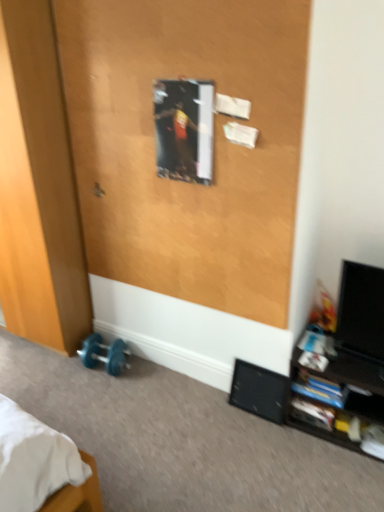
Question: Considering the relative sizes of wooden poster at upper center, which is counted as the 1th screen door, starting from the right, and black matte speaker at lower right in the image provided, is wooden poster at upper center, which is counted as the 1th screen door, starting from the right, bigger than black matte speaker at lower right?

Choices:
 (A) no
 (B) yes

Answer: (B)

Question: Can you confirm if wooden poster at upper center, which is counted as the 1th screen door, starting from the right, is smaller than black matte speaker at lower right?

Choices:
 (A) no
 (B) yes

Answer: (A)

Question: Considering the relative positions of wooden poster at upper center, arranged as the second screen door when viewed from the left, and black matte speaker at lower right in the image provided, is wooden poster at upper center, arranged as the second screen door when viewed from the left, behind black matte speaker at lower right?

Choices:
 (A) yes
 (B) no

Answer: (B)

Question: Can you confirm if wooden poster at upper center, which is counted as the 1th screen door, starting from the right, is wider than black matte speaker at lower right?

Choices:
 (A) no
 (B) yes

Answer: (A)

Question: Considering the relative sizes of wooden poster at upper center, which is counted as the 1th screen door, starting from the right, and black matte speaker at lower right in the image provided, is wooden poster at upper center, which is counted as the 1th screen door, starting from the right, thinner than black matte speaker at lower right?

Choices:
 (A) yes
 (B) no

Answer: (A)

Question: From a real-world perspective, is wooden poster at upper center, which is counted as the 1th screen door, starting from the right, under black matte speaker at lower right?

Choices:
 (A) no
 (B) yes

Answer: (A)

Question: From a real-world perspective, is wooden poster at upper center, which is counted as the 1th screen door, starting from the right, beneath metallic silver door handle at upper center?

Choices:
 (A) no
 (B) yes

Answer: (A)

Question: Is wooden poster at upper center, arranged as the second screen door when viewed from the left, further to camera compared to metallic silver door handle at upper center?

Choices:
 (A) no
 (B) yes

Answer: (A)

Question: From a real-world perspective, is wooden poster at upper center, arranged as the second screen door when viewed from the left, on top of metallic silver door handle at upper center?

Choices:
 (A) no
 (B) yes

Answer: (B)

Question: Considering the relative sizes of wooden poster at upper center, which is counted as the 1th screen door, starting from the right, and metallic silver door handle at upper center in the image provided, is wooden poster at upper center, which is counted as the 1th screen door, starting from the right, bigger than metallic silver door handle at upper center?

Choices:
 (A) yes
 (B) no

Answer: (A)

Question: From the image's perspective, would you say wooden poster at upper center, arranged as the second screen door when viewed from the left, is positioned over metallic silver door handle at upper center?

Choices:
 (A) yes
 (B) no

Answer: (A)

Question: Is wooden poster at upper center, which is counted as the 1th screen door, starting from the right, taller than metallic silver door handle at upper center?

Choices:
 (A) yes
 (B) no

Answer: (A)

Question: Is black matte speaker at lower right at the right side of black glossy shelf at lower right?

Choices:
 (A) no
 (B) yes

Answer: (A)